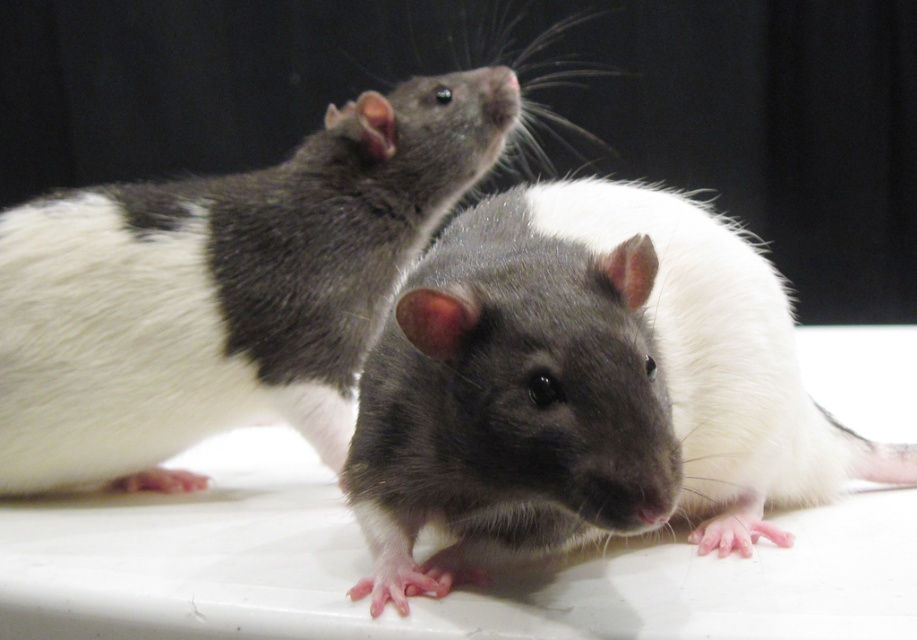
Question: Which object appears closest to the camera in this image?

Choices:
 (A) shiny gray fur at center
 (B) shiny fur mouse at center

Answer: (A)

Question: Is shiny fur mouse at center smaller than shiny gray fur at center?

Choices:
 (A) yes
 (B) no

Answer: (A)

Question: Is shiny fur mouse at center smaller than shiny gray fur at center?

Choices:
 (A) yes
 (B) no

Answer: (A)

Question: Which point is farther from the camera taking this photo?

Choices:
 (A) (393, 525)
 (B) (304, 348)

Answer: (B)

Question: Does shiny fur mouse at center appear over shiny gray fur at center?

Choices:
 (A) yes
 (B) no

Answer: (A)